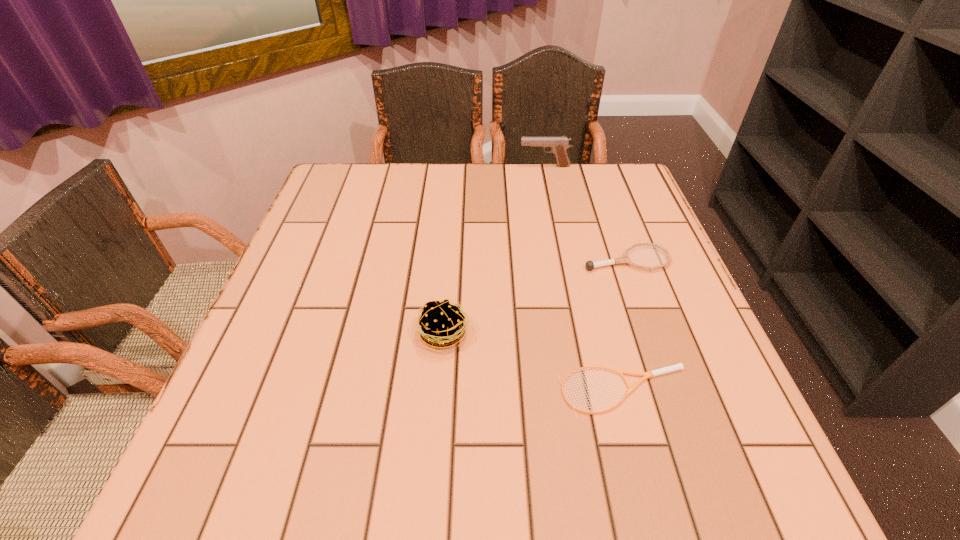
The height and width of the screenshot is (540, 960). I want to click on free space between the shorter tennis racket and the pistol, so click(x=585, y=279).

Select which object appears as the third closest to the farthest object. Please provide its 2D coordinates. Your answer should be formatted as a tuple, i.e. [(x, y)], where the tuple contains the x and y coordinates of a point satisfying the conditions above.

[(650, 374)]

Locate an element on the screen. The image size is (960, 540). object that is the second closest to the taller tennis racket is located at coordinates (442, 324).

Locate an element on the screen. The height and width of the screenshot is (540, 960). free space that satisfies the following two spatial constraints: 1. on the back side of the nearer tennis racket; 2. on the right side of the third nearest object is located at coordinates (589, 260).

This screenshot has width=960, height=540. What are the coordinates of `free region that satisfies the following two spatial constraints: 1. on the back side of the taller tennis racket; 2. on the right side of the second tallest object` in the screenshot? It's located at (449, 260).

Where is `free space that satisfies the following two spatial constraints: 1. at the barrel of the nearer tennis racket; 2. on the right side of the farthest object`? The height and width of the screenshot is (540, 960). free space that satisfies the following two spatial constraints: 1. at the barrel of the nearer tennis racket; 2. on the right side of the farthest object is located at coordinates (590, 391).

Image resolution: width=960 pixels, height=540 pixels. What are the coordinates of `free space that satisfies the following two spatial constraints: 1. at the barrel of the nearest object; 2. on the left side of the pistol` in the screenshot? It's located at pyautogui.click(x=590, y=391).

You are a GUI agent. You are given a task and a screenshot of the screen. Output one action in this format:
    pyautogui.click(x=<x>, y=<y>)
    Task: Click on the free space that satisfies the following two spatial constraints: 1. at the barrel of the shortest object; 2. on the right side of the farthest object
    
    Given the screenshot: What is the action you would take?
    pyautogui.click(x=590, y=391)

In order to click on vacant region that satisfies the following two spatial constraints: 1. at the barrel of the tallest object; 2. on the left side of the shorter tennis racket in this screenshot , I will do `click(590, 391)`.